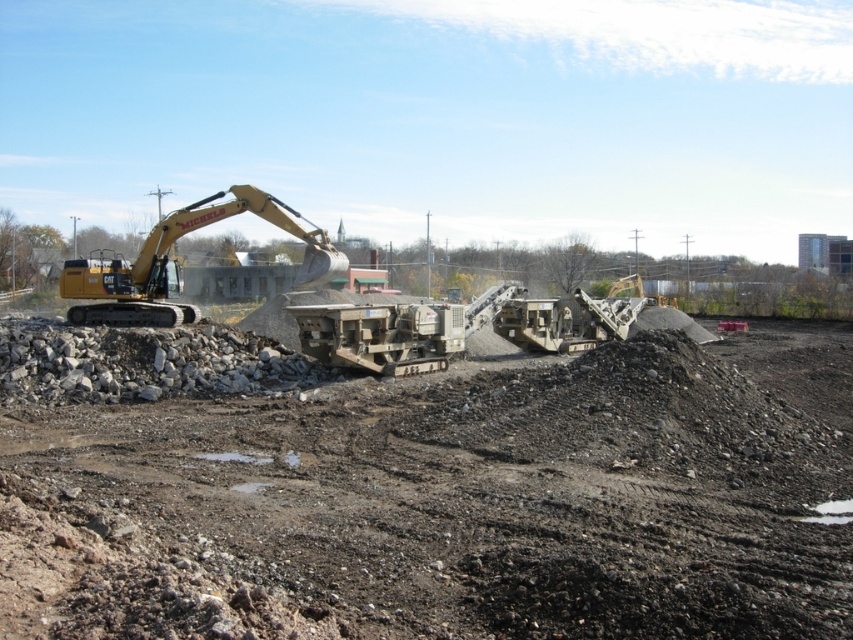
Question: Which object appears closest to the camera in this image?

Choices:
 (A) yellow metallic excavator at center-left
 (B) dull brown soil at center

Answer: (B)

Question: Can you confirm if dull brown soil at center is positioned to the right of yellow metallic excavator at center-left?

Choices:
 (A) yes
 (B) no

Answer: (A)

Question: Can you confirm if dull brown soil at center is positioned below yellow metallic excavator at center-left?

Choices:
 (A) no
 (B) yes

Answer: (B)

Question: Is dull brown soil at center wider than yellow metallic excavator at center-left?

Choices:
 (A) yes
 (B) no

Answer: (B)

Question: Which point appears closest to the camera in this image?

Choices:
 (A) (83, 285)
 (B) (648, 492)

Answer: (B)